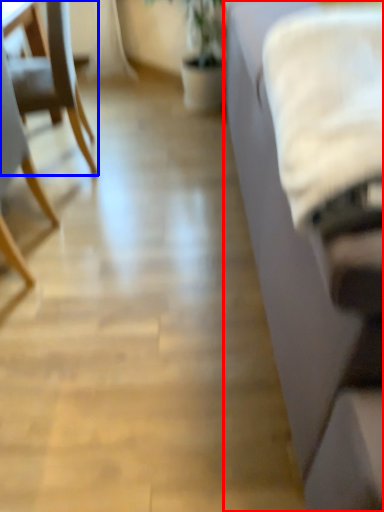
Question: Which point is further to the camera, studio couch (highlighted by a red box) or chair (highlighted by a blue box)?

Choices:
 (A) studio couch
 (B) chair

Answer: (B)